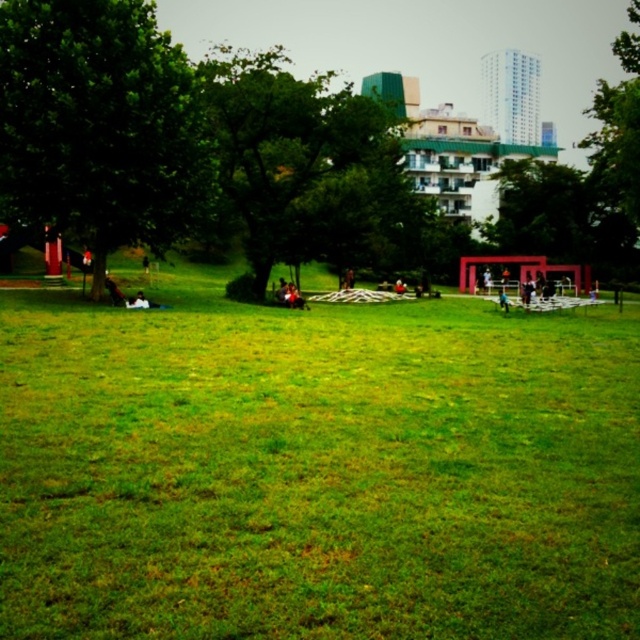
Question: Which object is the closest to the green leafy tree at right?

Choices:
 (A) green leafy tree at left
 (B) smooth black shirt at center

Answer: (A)

Question: Which object appears farthest from the camera in this image?

Choices:
 (A) green leafy tree at left
 (B) green leafy tree at right
 (C) green leafy tree at center
 (D) smooth black shirt at center

Answer: (B)

Question: Where is green leafy tree at center located in relation to smooth black shirt at center in the image?

Choices:
 (A) left
 (B) right

Answer: (A)

Question: Can you confirm if green leafy tree at center is smaller than smooth black shirt at center?

Choices:
 (A) no
 (B) yes

Answer: (A)

Question: Which object is farther from the camera taking this photo?

Choices:
 (A) green leafy tree at center
 (B) green leafy tree at left
 (C) green leafy tree at right

Answer: (C)

Question: Is green leafy tree at left bigger than green leafy tree at center?

Choices:
 (A) no
 (B) yes

Answer: (A)